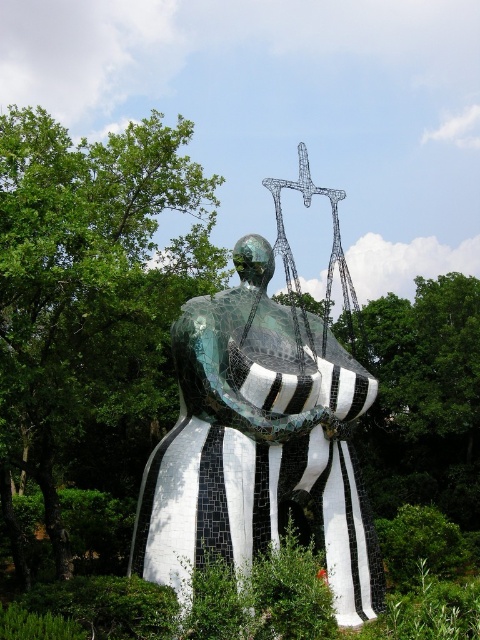
Question: Which point is farther from the camera taking this photo?

Choices:
 (A) (51, 129)
 (B) (239, 420)

Answer: (A)

Question: Which point is closer to the camera taking this photo?

Choices:
 (A) (180, 484)
 (B) (39, 404)

Answer: (B)

Question: Can you confirm if green leafy tree at left is bigger than black and white mosaic statue at center?

Choices:
 (A) no
 (B) yes

Answer: (B)

Question: Considering the real-world distances, which object is farthest from the metallic wire sculpture at upper center?

Choices:
 (A) green leafy tree at left
 (B) black and white mosaic statue at center

Answer: (A)

Question: Is green leafy tree at left to the left of metallic wire sculpture at upper center from the viewer's perspective?

Choices:
 (A) no
 (B) yes

Answer: (B)

Question: Does green leafy tree at left appear under metallic wire sculpture at upper center?

Choices:
 (A) no
 (B) yes

Answer: (B)